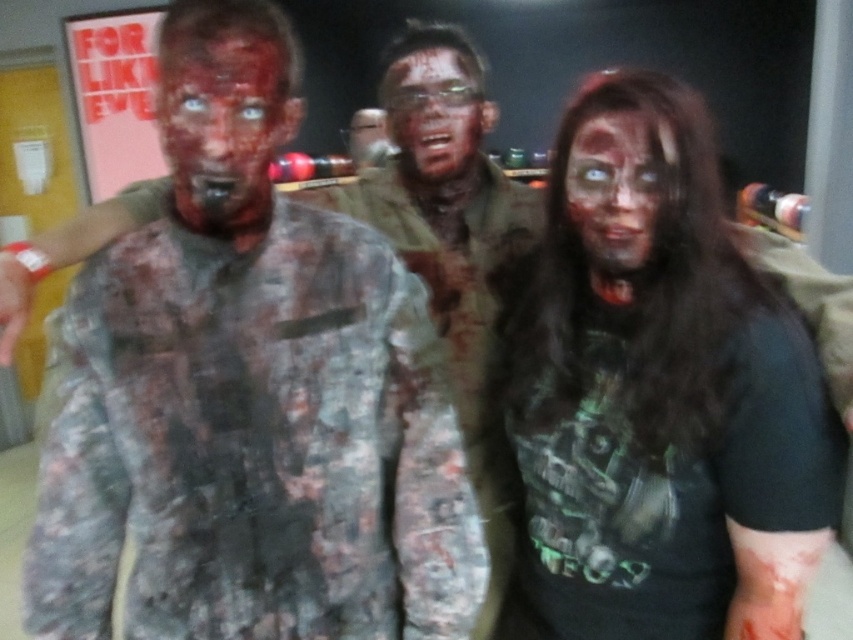
Question: Among these objects, which one is nearest to the camera?

Choices:
 (A) camouflage uniform at center
 (B) matte skin face at center
 (C) blood-stained face at center

Answer: (A)

Question: Can you confirm if matte blood at center is bigger than matte skin face at center?

Choices:
 (A) yes
 (B) no

Answer: (A)

Question: Observing the image, what is the correct spatial positioning of matte blood at center in reference to matte skin face at center?

Choices:
 (A) right
 (B) left

Answer: (B)

Question: Does camouflage uniform at center have a lesser width compared to blood-stained face at center?

Choices:
 (A) yes
 (B) no

Answer: (B)

Question: Estimate the real-world distances between objects in this image. Which object is closer to the blood-stained face at center?

Choices:
 (A) matte skin face at center
 (B) camouflage uniform at center
 (C) matte blood at center

Answer: (A)

Question: Among these objects, which one is farthest from the camera?

Choices:
 (A) blood-stained face at center
 (B) matte blood at center

Answer: (A)